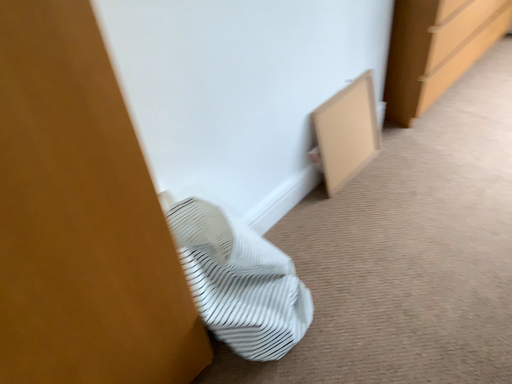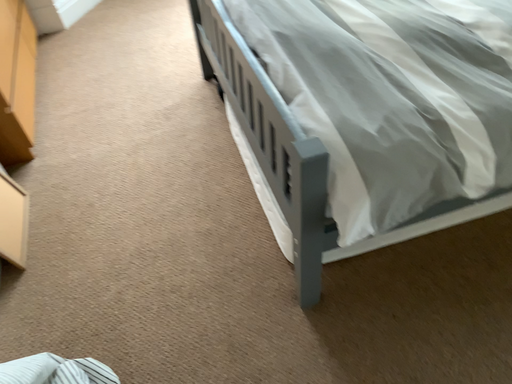
Question: Which way did the camera rotate in the video?

Choices:
 (A) rotated right
 (B) rotated left

Answer: (A)